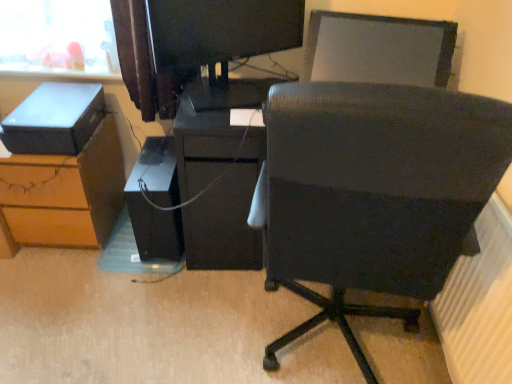
Question: Is white textured radiator at lower right to the left of matte black desk at center from the viewer's perspective?

Choices:
 (A) no
 (B) yes

Answer: (A)

Question: Is white textured radiator at lower right wider than matte black desk at center?

Choices:
 (A) no
 (B) yes

Answer: (A)

Question: From the image's perspective, is white textured radiator at lower right located above matte black desk at center?

Choices:
 (A) no
 (B) yes

Answer: (A)

Question: Is matte black desk at center at the back of white textured radiator at lower right?

Choices:
 (A) no
 (B) yes

Answer: (A)

Question: Is white textured radiator at lower right bigger than matte black desk at center?

Choices:
 (A) no
 (B) yes

Answer: (A)

Question: Does point (496, 380) appear closer or farther from the camera than point (27, 105)?

Choices:
 (A) closer
 (B) farther

Answer: (A)

Question: From a real-world perspective, is white textured radiator at lower right above or below matte black storage box at left?

Choices:
 (A) above
 (B) below

Answer: (B)

Question: In terms of width, does white textured radiator at lower right look wider or thinner when compared to matte black storage box at left?

Choices:
 (A) wide
 (B) thin

Answer: (B)

Question: Considering their positions, is white textured radiator at lower right located in front of or behind matte black storage box at left?

Choices:
 (A) front
 (B) behind

Answer: (A)

Question: Considering the positions of point (194, 208) and point (384, 241), is point (194, 208) closer or farther from the camera than point (384, 241)?

Choices:
 (A) closer
 (B) farther

Answer: (B)

Question: Considering the positions of matte black desk at center and black fabric chair at center in the image, is matte black desk at center taller or shorter than black fabric chair at center?

Choices:
 (A) short
 (B) tall

Answer: (A)

Question: Would you say matte black desk at center is inside or outside black fabric chair at center?

Choices:
 (A) outside
 (B) inside

Answer: (A)

Question: From the image's perspective, is matte black desk at center positioned above or below black fabric chair at center?

Choices:
 (A) above
 (B) below

Answer: (A)

Question: Visually, is black fabric chair at center positioned to the left or to the right of brown wood desk at lower left?

Choices:
 (A) left
 (B) right

Answer: (B)

Question: Considering the positions of black fabric chair at center and brown wood desk at lower left in the image, is black fabric chair at center wider or thinner than brown wood desk at lower left?

Choices:
 (A) thin
 (B) wide

Answer: (B)